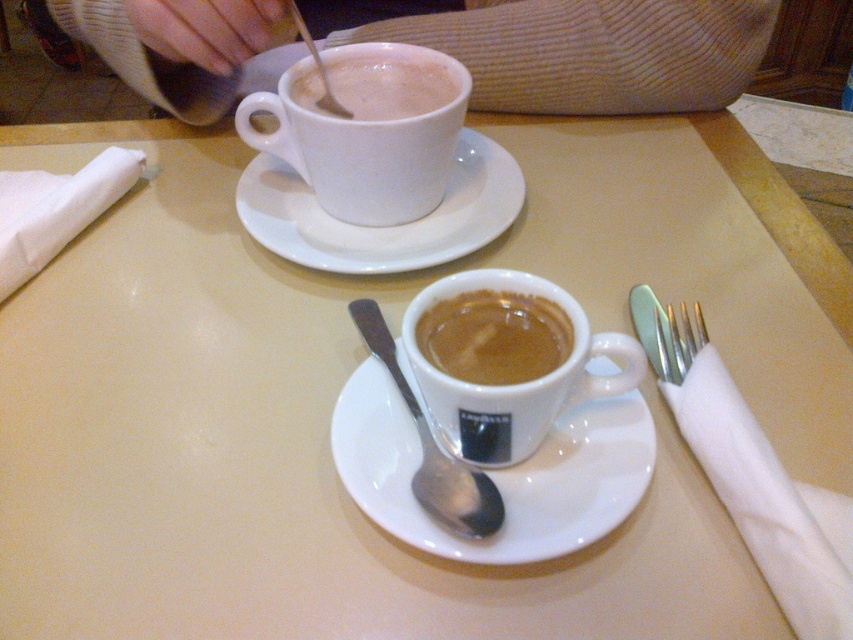
Question: Is white ceramic saucer at upper center to the right of white glossy cup at center from the viewer's perspective?

Choices:
 (A) yes
 (B) no

Answer: (B)

Question: Does white glossy cup at center have a smaller size compared to silver metallic fork at right?

Choices:
 (A) yes
 (B) no

Answer: (B)

Question: Observing the image, what is the correct spatial positioning of brown matte espresso cup at center in reference to matte white cup at upper center?

Choices:
 (A) above
 (B) below

Answer: (B)

Question: Which object appears farthest from the camera in this image?

Choices:
 (A) white ceramic saucer at upper center
 (B) white glossy cup at center

Answer: (A)

Question: Among these objects, which one is nearest to the camera?

Choices:
 (A) white ceramic mug at upper center
 (B) white ceramic saucer at upper center
 (C) silver metallic spoon at center

Answer: (C)

Question: Which of the following is the closest to the observer?

Choices:
 (A) beige knitted sweater at upper center
 (B) white ceramic saucer at center
 (C) white ceramic mug at upper center
 (D) white glossy cup at center

Answer: (D)